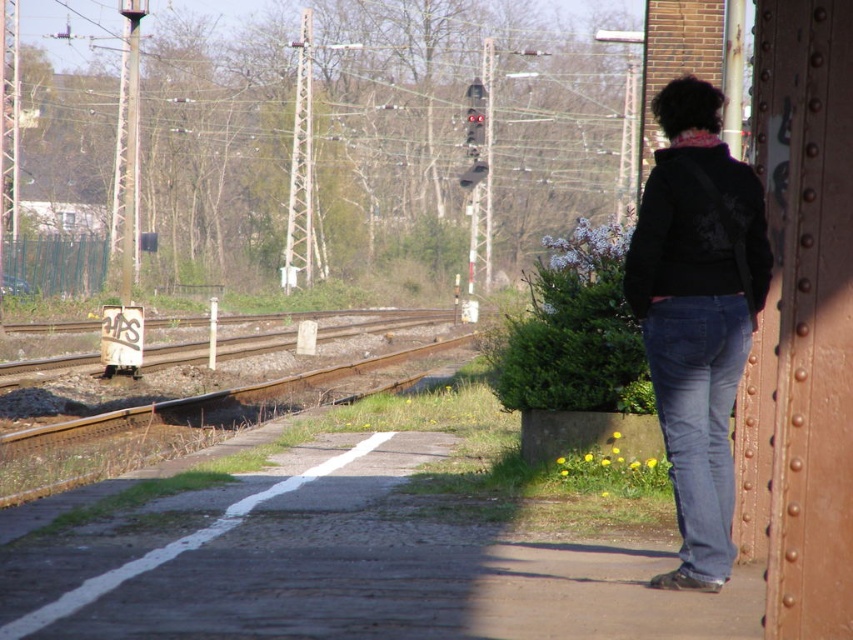
Who is taller, dark blue jeans at right or rusty metal track at left?

dark blue jeans at right is taller.

Does point (730, 365) lie behind point (189, 408)?

No, it is in front of (189, 408).

This screenshot has width=853, height=640. Identify the location of dark blue jeans at right. (697, 314).

Who is lower down, rusty metal track at left or rusty metal train track at center?

rusty metal track at left is below.

Does rusty metal track at left have a greater width compared to rusty metal train track at center?

Incorrect, rusty metal track at left's width does not surpass rusty metal train track at center's.

Identify the location of rusty metal track at left. The height and width of the screenshot is (640, 853). (207, 401).

Identify the location of rusty metal track at left. (207, 401).

How far apart are dark blue jeans at right and rusty metal train track at center?

dark blue jeans at right and rusty metal train track at center are 22.79 meters apart from each other.

Is point (657, 337) less distant than point (291, 330)?

Yes, it is in front of point (291, 330).

Image resolution: width=853 pixels, height=640 pixels. In order to click on dark blue jeans at right in this screenshot , I will do click(697, 314).